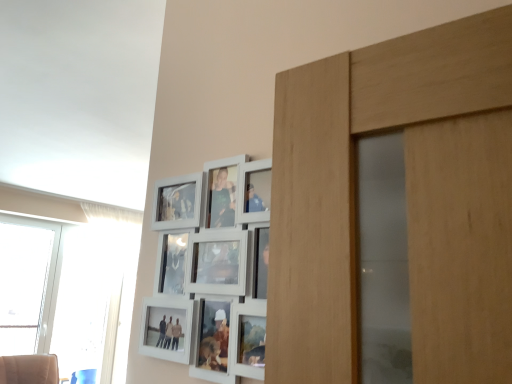
In the scene shown: Measure the distance between transparent glass window at left, which is counted as the second window, starting from the left, and camera.

transparent glass window at left, which is counted as the second window, starting from the left, and camera are 4.75 meters apart from each other.

Find the location of a particular element. This screenshot has width=512, height=384. transparent glass window at left, which is counted as the second window, starting from the left is located at coordinates (88, 301).

The height and width of the screenshot is (384, 512). What do you see at coordinates (88, 301) in the screenshot?
I see `transparent glass window at left, the 1th window when ordered from right to left` at bounding box center [88, 301].

Locate an element on the screen. transparent glass window at left, the first window from the left is located at coordinates (28, 283).

The height and width of the screenshot is (384, 512). Describe the element at coordinates (28, 283) in the screenshot. I see `transparent glass window at left, the first window from the left` at that location.

Measure the distance between transparent glass window at left, acting as the 2th window starting from the right, and camera.

transparent glass window at left, acting as the 2th window starting from the right, and camera are 4.79 meters apart.

You are a GUI agent. You are given a task and a screenshot of the screen. Output one action in this format:
    pyautogui.click(x=<x>, y=<y>)
    Task: Click on the transparent glass window at left, which is counted as the second window, starting from the left
    Image resolution: width=512 pixels, height=384 pixels.
    Given the screenshot: What is the action you would take?
    pyautogui.click(x=88, y=301)

Is transparent glass window at left, which is counted as the second window, starting from the left, at the left side of transparent glass window at left, the first window from the left?

Incorrect, transparent glass window at left, which is counted as the second window, starting from the left, is not on the left side of transparent glass window at left, the first window from the left.

Is the position of transparent glass window at left, the 1th window when ordered from right to left, more distant than that of transparent glass window at left, the first window from the left?

Yes, it is.

Which point is more forward, (84,296) or (42,334)?

Positioned in front is point (42,334).

From the image's perspective, relative to transparent glass window at left, acting as the 2th window starting from the right, is transparent glass window at left, the 1th window when ordered from right to left, above or below?

transparent glass window at left, the 1th window when ordered from right to left, is situated lower than transparent glass window at left, acting as the 2th window starting from the right, in the image.

From a real-world perspective, is transparent glass window at left, the 1th window when ordered from right to left, over transparent glass window at left, the first window from the left?

No, from a real-world perspective, transparent glass window at left, the 1th window when ordered from right to left, is not over transparent glass window at left, the first window from the left

Can you confirm if transparent glass window at left, the 1th window when ordered from right to left, is wider than transparent glass window at left, acting as the 2th window starting from the right?

Incorrect, the width of transparent glass window at left, the 1th window when ordered from right to left, does not surpass that of transparent glass window at left, acting as the 2th window starting from the right.

In terms of height, does transparent glass window at left, which is counted as the second window, starting from the left, look taller or shorter compared to transparent glass window at left, acting as the 2th window starting from the right?

transparent glass window at left, which is counted as the second window, starting from the left, is taller than transparent glass window at left, acting as the 2th window starting from the right.

Can you confirm if transparent glass window at left, which is counted as the second window, starting from the left, is bigger than transparent glass window at left, the first window from the left?

No, transparent glass window at left, which is counted as the second window, starting from the left, is not bigger than transparent glass window at left, the first window from the left.

Is transparent glass window at left, which is counted as the second window, starting from the left, completely or partially outside of transparent glass window at left, the first window from the left?

Yes, transparent glass window at left, which is counted as the second window, starting from the left, is outside of transparent glass window at left, the first window from the left.

Are transparent glass window at left, the 1th window when ordered from right to left, and transparent glass window at left, the first window from the left, located far from each other?

transparent glass window at left, the 1th window when ordered from right to left, is near transparent glass window at left, the first window from the left, not far away.

Is transparent glass window at left, the 1th window when ordered from right to left, looking in the opposite direction of transparent glass window at left, the first window from the left?

transparent glass window at left, the 1th window when ordered from right to left, does not have its back to transparent glass window at left, the first window from the left.

Locate an element on the screen. Image resolution: width=512 pixels, height=384 pixels. window below the transparent glass window at left, acting as the 2th window starting from the right (from a real-world perspective) is located at coordinates (88, 301).

Can you confirm if transparent glass window at left, acting as the 2th window starting from the right, is positioned to the right of transparent glass window at left, which is counted as the second window, starting from the left?

Incorrect, transparent glass window at left, acting as the 2th window starting from the right, is not on the right side of transparent glass window at left, which is counted as the second window, starting from the left.

Does transparent glass window at left, the first window from the left, lie in front of transparent glass window at left, which is counted as the second window, starting from the left?

That is True.

Considering the positions of points (17, 316) and (92, 361), is point (17, 316) closer to camera compared to point (92, 361)?

Yes.

From the image's perspective, between transparent glass window at left, acting as the 2th window starting from the right, and transparent glass window at left, the 1th window when ordered from right to left, who is located below?

transparent glass window at left, the 1th window when ordered from right to left.

From a real-world perspective, is transparent glass window at left, acting as the 2th window starting from the right, physically below transparent glass window at left, the 1th window when ordered from right to left?

No, from a real-world perspective, transparent glass window at left, acting as the 2th window starting from the right, is not under transparent glass window at left, the 1th window when ordered from right to left.

Which of these two, transparent glass window at left, the first window from the left, or transparent glass window at left, the 1th window when ordered from right to left, is thinner?

Thinner between the two is transparent glass window at left, the 1th window when ordered from right to left.

Looking at this image, does transparent glass window at left, acting as the 2th window starting from the right, have a lesser height compared to transparent glass window at left, the 1th window when ordered from right to left?

Yes, transparent glass window at left, acting as the 2th window starting from the right, is shorter than transparent glass window at left, the 1th window when ordered from right to left.

Who is bigger, transparent glass window at left, the first window from the left, or transparent glass window at left, the 1th window when ordered from right to left?

transparent glass window at left, the first window from the left.

Which is correct: transparent glass window at left, acting as the 2th window starting from the right, is inside transparent glass window at left, which is counted as the second window, starting from the left, or outside of it?

transparent glass window at left, acting as the 2th window starting from the right, exists outside the volume of transparent glass window at left, which is counted as the second window, starting from the left.

Are transparent glass window at left, the first window from the left, and transparent glass window at left, the 1th window when ordered from right to left, far apart?

No, there isn't a large distance between transparent glass window at left, the first window from the left, and transparent glass window at left, the 1th window when ordered from right to left.

Could you tell me if transparent glass window at left, acting as the 2th window starting from the right, is turned towards transparent glass window at left, which is counted as the second window, starting from the left?

No, transparent glass window at left, acting as the 2th window starting from the right, is not oriented towards transparent glass window at left, which is counted as the second window, starting from the left.

How different are the orientations of transparent glass window at left, acting as the 2th window starting from the right, and transparent glass window at left, which is counted as the second window, starting from the left, in degrees?

There is a 0.000418-degree angle between the facing directions of transparent glass window at left, acting as the 2th window starting from the right, and transparent glass window at left, which is counted as the second window, starting from the left.

How much distance is there between transparent glass window at left, acting as the 2th window starting from the right, and transparent glass window at left, the 1th window when ordered from right to left?

A distance of 15.20 inches exists between transparent glass window at left, acting as the 2th window starting from the right, and transparent glass window at left, the 1th window when ordered from right to left.

This screenshot has height=384, width=512. Identify the location of window that appears behind the transparent glass window at left, the first window from the left. (88, 301).

Image resolution: width=512 pixels, height=384 pixels. In order to click on window on the right of the transparent glass window at left, acting as the 2th window starting from the right in this screenshot , I will do `click(88, 301)`.

Where is `window above the transparent glass window at left, which is counted as the second window, starting from the left (from the image's perspective)`? This screenshot has height=384, width=512. window above the transparent glass window at left, which is counted as the second window, starting from the left (from the image's perspective) is located at coordinates (28, 283).